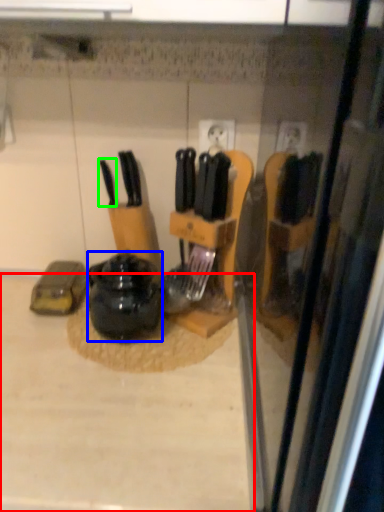
Question: Considering the real-world distances, which object is farthest from counter top (highlighted by a red box)? kitchen appliance (highlighted by a blue box) or knife (highlighted by a green box)?

Choices:
 (A) kitchen appliance
 (B) knife

Answer: (B)